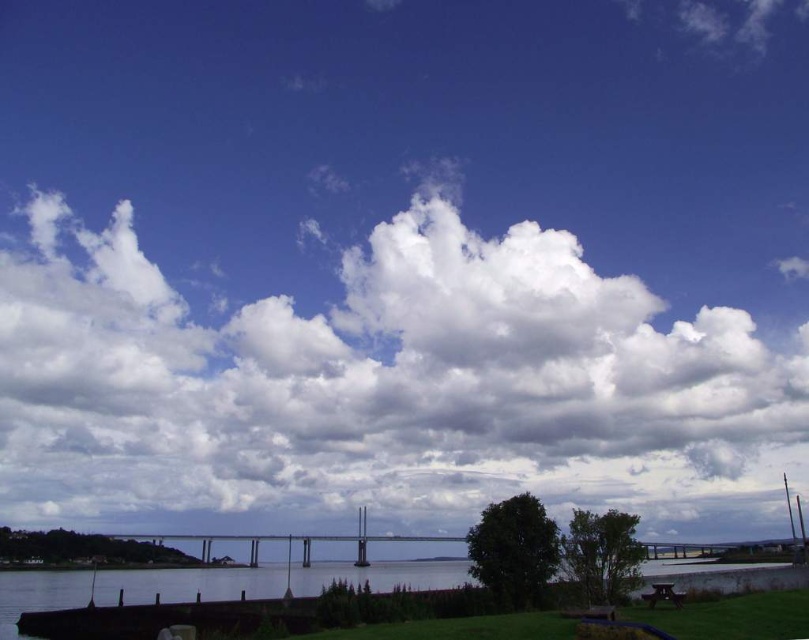
Can you confirm if clear water at lower center is shorter than wooden park bench at lower right?

In fact, clear water at lower center may be taller than wooden park bench at lower right.

Is clear water at lower center closer to the viewer compared to wooden park bench at lower right?

That is False.

I want to click on clear water at lower center, so tap(205, 582).

This screenshot has height=640, width=809. In order to click on white fluffy cloud at upper center in this screenshot , I will do `click(382, 387)`.

Between white fluffy cloud at upper center and wooden park bench at lower right, which one has less height?

wooden park bench at lower right is shorter.

Who is more distant from viewer, [320,312] or [672,602]?

The point [320,312] is more distant.

Where is `white fluffy cloud at upper center`? This screenshot has height=640, width=809. white fluffy cloud at upper center is located at coordinates (382, 387).

Which is below, white fluffy cloud at upper center or clear water at lower center?

clear water at lower center

Between point (545, 472) and point (184, 580), which one is positioned behind?

Point (545, 472)

The width and height of the screenshot is (809, 640). Identify the location of white fluffy cloud at upper center. (382, 387).